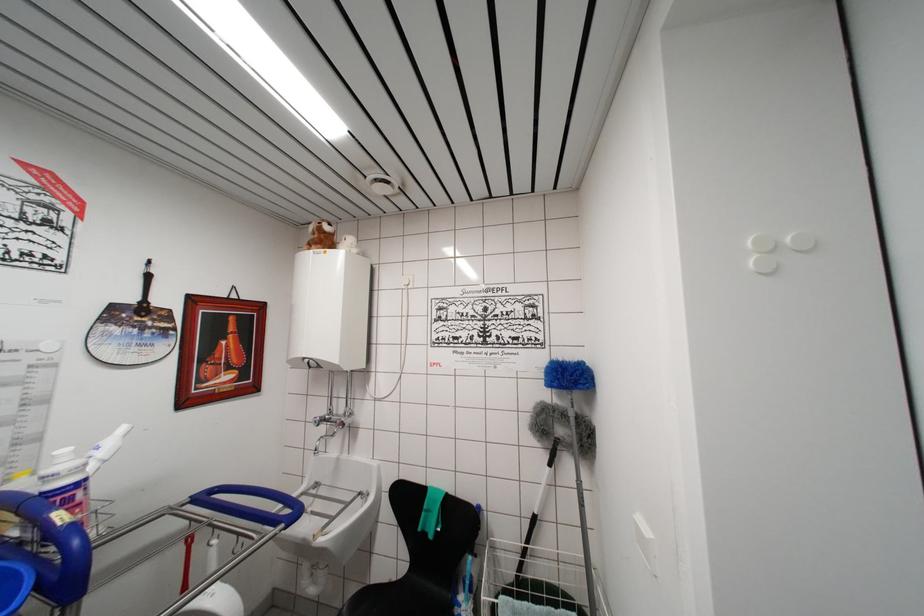
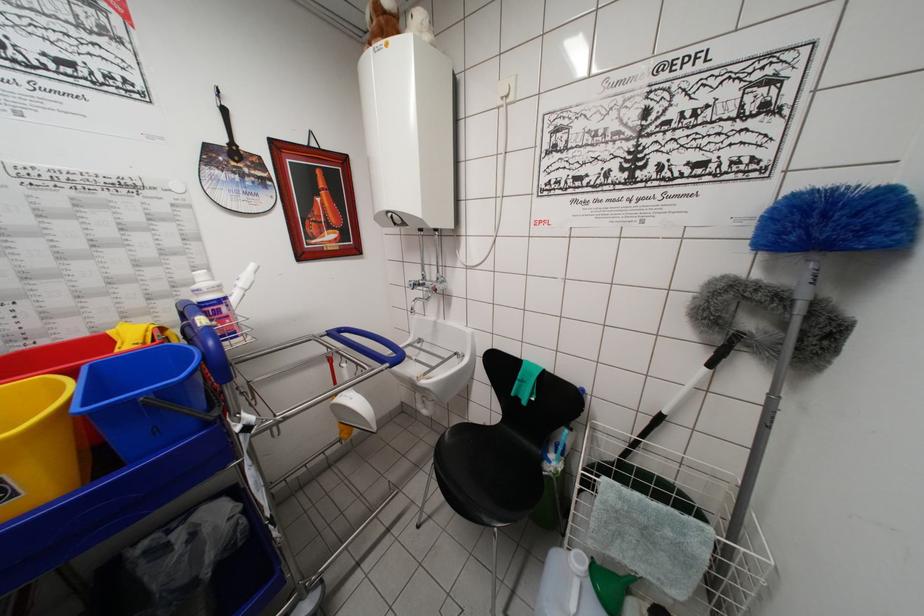
First-person continuous shooting, in which direction is the camera rotating?

The camera's rotation is toward left-down.